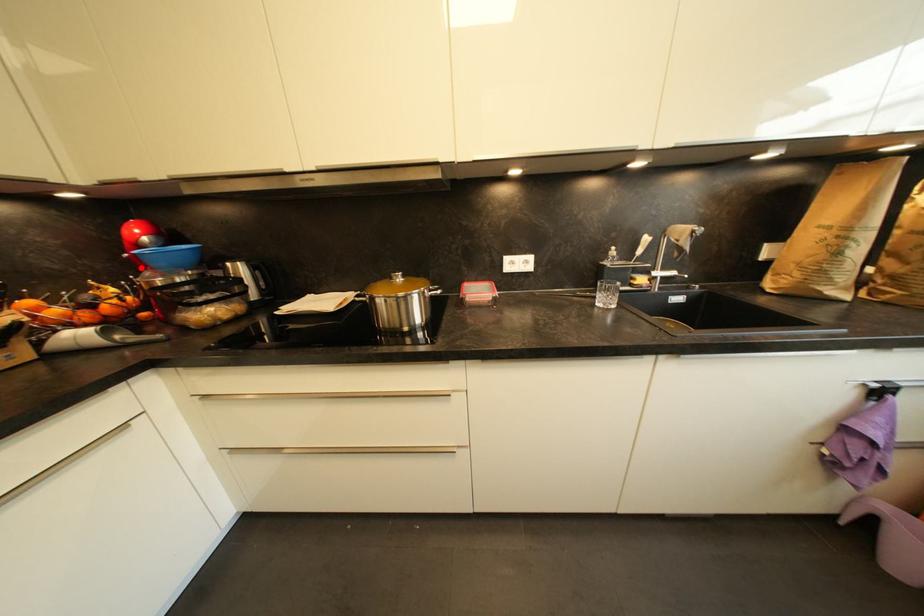
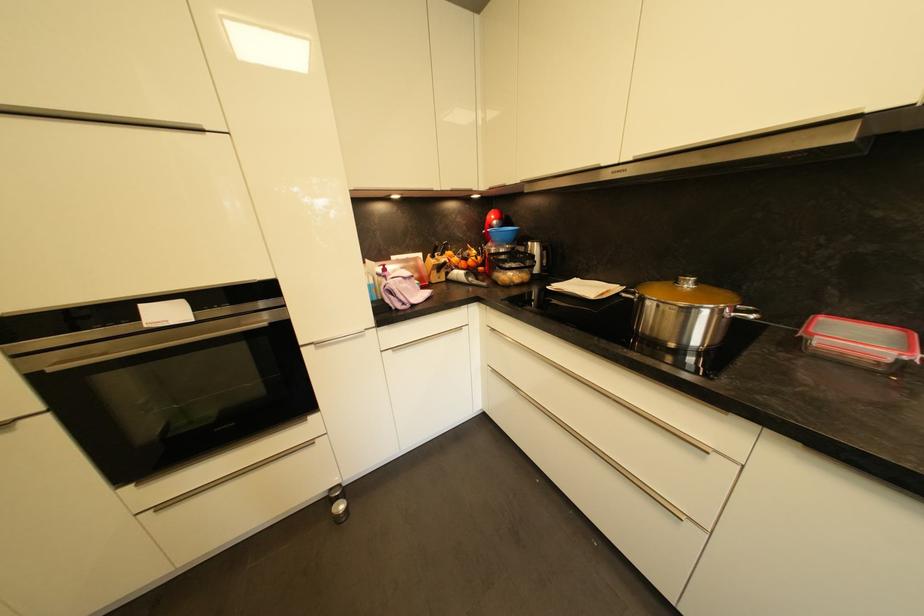
Question: I am providing you with two images of the same scene from different viewpoints. In image1, a red point is highlighted. Considering the same 3D point in image2, which of the following is correct?

Choices:
 (A) It is closer
 (B) It is farther

Answer: (A)